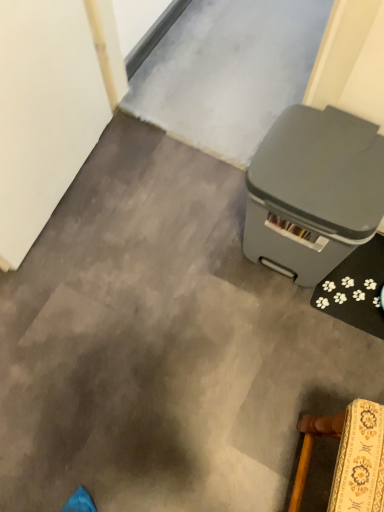
At what (x,y) coordinates should I click in order to perform the action: click on vacant area on the back side of wooden upholstered chair at lower right. Please return your answer as a coordinate pair (x, y). This screenshot has height=512, width=384. Looking at the image, I should click on (311, 371).